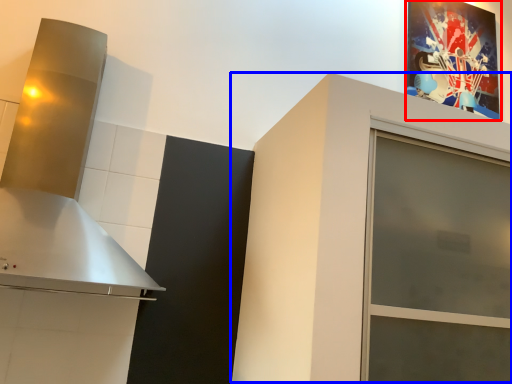
Question: Which object is further to the camera taking this photo, picture frame (highlighted by a red box) or cabinetry (highlighted by a blue box)?

Choices:
 (A) picture frame
 (B) cabinetry

Answer: (A)